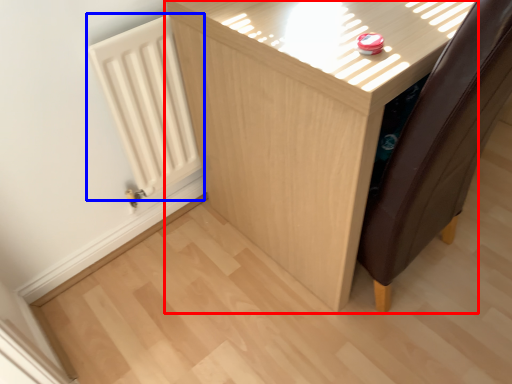
Question: Which object is closer to the camera taking this photo, furniture (highlighted by a red box) or radiator (highlighted by a blue box)?

Choices:
 (A) furniture
 (B) radiator

Answer: (A)